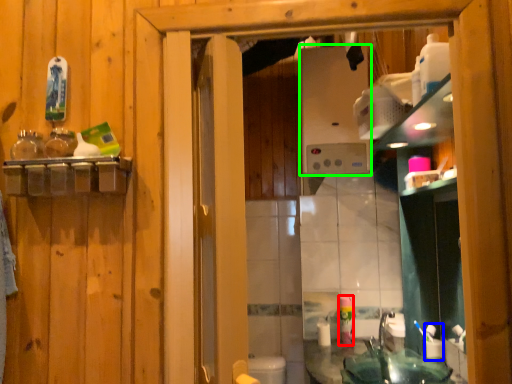
Question: Considering the real-world distances, which object is farthest from mouthwash (highlighted by a red box)? toiletry (highlighted by a blue box) or appliance (highlighted by a green box)?

Choices:
 (A) toiletry
 (B) appliance

Answer: (B)